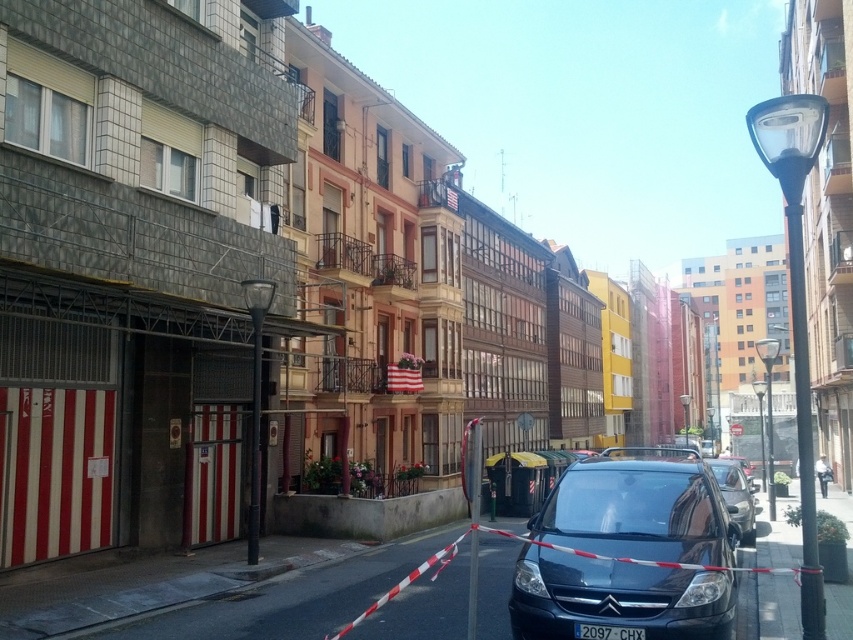
You are a delivery driver who needs to park your truck next to the shiny black car at center and the black plastic license plate at center. Since your truck is 6 meters long, can you fit it between them?

The shiny black car at center is bigger than the black plastic license plate at center, but the distance between them isn t specified. Without knowing the exact spacing, it s impossible to determine if the truck will fit.

You are a pedestrian standing on the sidewalk and see the shiny blue car at center and the shiny black car at center. Which one is closer to the Citroen van parked in the foreground?

The shiny blue car at center is closer to the Citroen van parked in the foreground because it is positioned on the left side of the shiny black car at center, which is further away.

You are a delivery driver who needs to park your vehicle in a spot that is exactly the size of the black plastic license plate at center. Can the shiny blue car at center fit into this parking space?

The shiny blue car at center is wider than the black plastic license plate at center, so it cannot fit into a parking space sized exactly for the license plate.